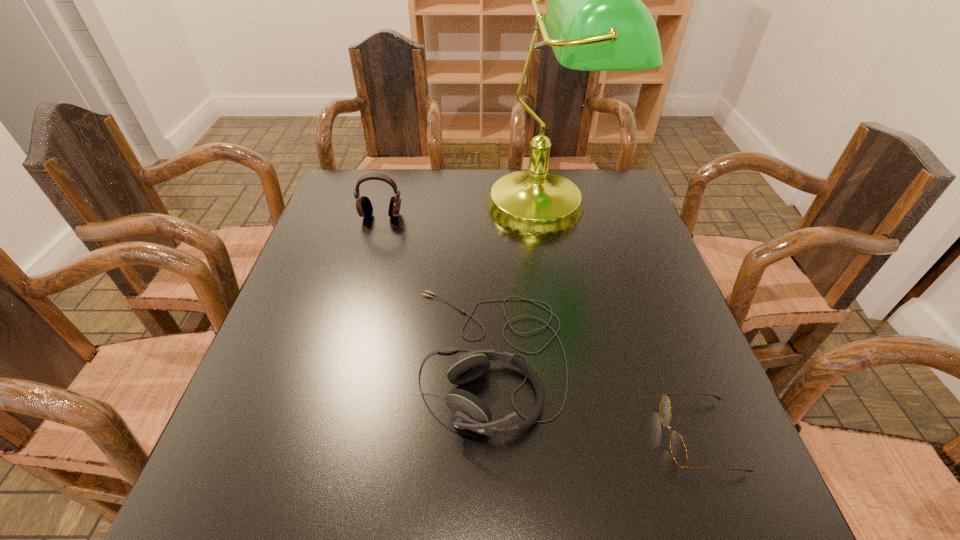
Find the location of a particular element. vacant area that lies between the farther headset and the sunglasses is located at coordinates (540, 327).

Locate an element on the screen. free space that is in between the third tallest object and the taller headset is located at coordinates (436, 287).

Where is `vacant space in between the sunglasses and the second shortest object`? Image resolution: width=960 pixels, height=540 pixels. vacant space in between the sunglasses and the second shortest object is located at coordinates (594, 397).

You are a GUI agent. You are given a task and a screenshot of the screen. Output one action in this format:
    pyautogui.click(x=<x>, y=<y>)
    Task: Click on the free space between the shortest object and the nearer headset
    
    Given the screenshot: What is the action you would take?
    pyautogui.click(x=594, y=397)

This screenshot has width=960, height=540. In order to click on empty space that is in between the left headset and the nearer headset in this screenshot , I will do `click(436, 287)`.

The width and height of the screenshot is (960, 540). I want to click on vacant point located between the taller headset and the lamp, so click(x=464, y=211).

Image resolution: width=960 pixels, height=540 pixels. I want to click on free space between the tallest object and the sunglasses, so click(x=623, y=321).

Where is `empty location between the left headset and the lamp`? The height and width of the screenshot is (540, 960). empty location between the left headset and the lamp is located at coordinates (464, 211).

At what (x,y) coordinates should I click in order to perform the action: click on vacant space that is in between the sunglasses and the lamp. Please return your answer as a coordinate pair (x, y). This screenshot has height=540, width=960. Looking at the image, I should click on (623, 321).

Find the location of a particular element. vacant space that's between the shortest object and the tallest object is located at coordinates click(623, 321).